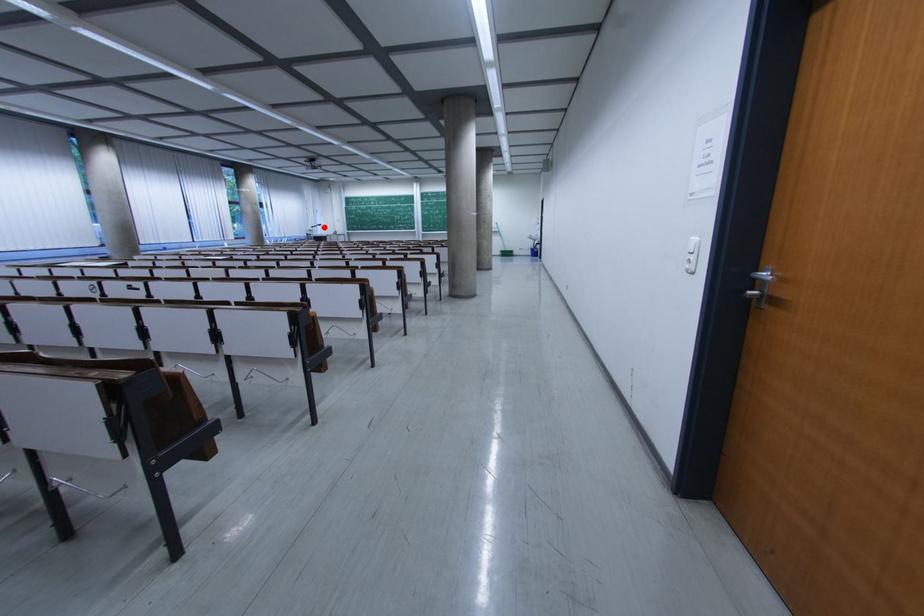
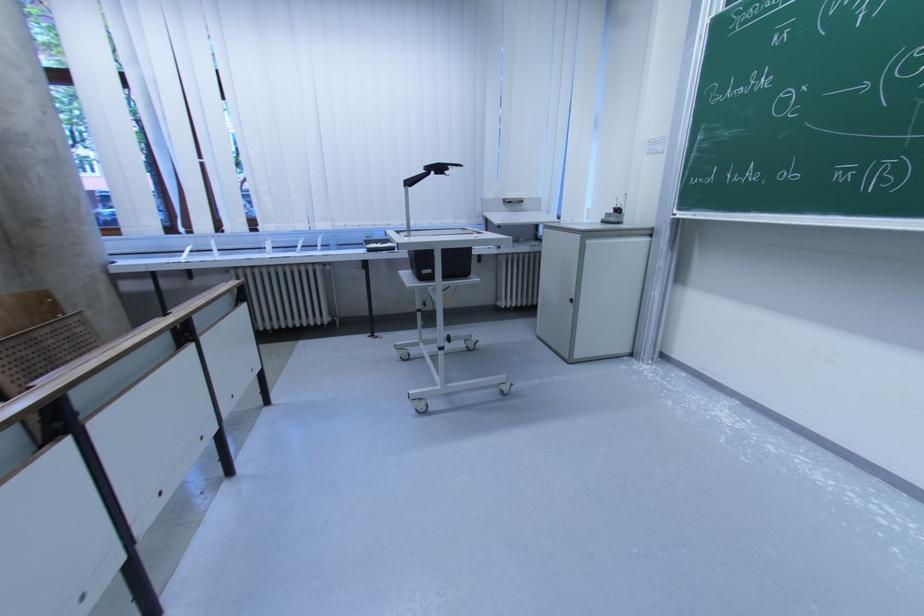
The point at the highlighted location is marked in the first image. Where is the corresponding point in the second image?

(444, 171)